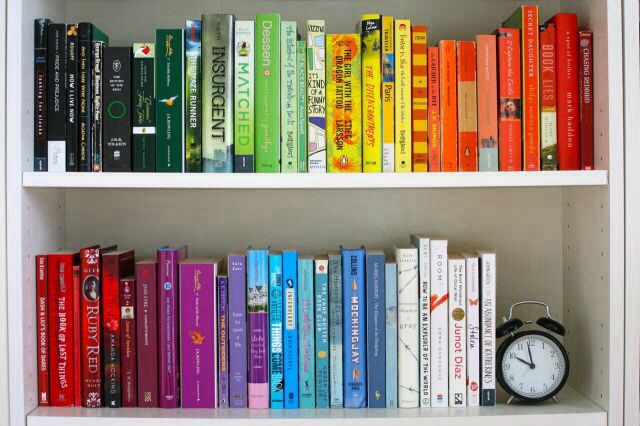
The height and width of the screenshot is (426, 640). Find the location of `black books`. black books is located at coordinates (38, 114), (54, 117), (70, 121), (81, 112), (96, 113), (113, 100), (139, 111).